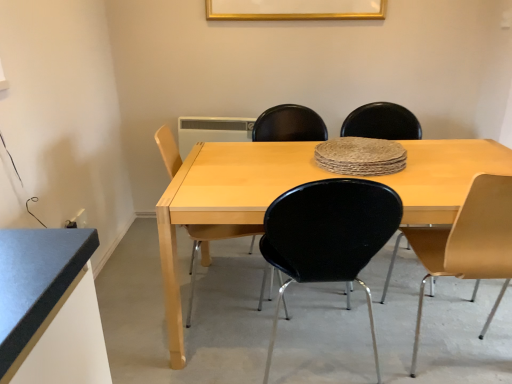
Locate an element on the screen. free area in between matte black chair at center, placed as the second chair when sorted from right to left, and glossy black chair at center, which is the 2th chair from left to right is located at coordinates (357, 311).